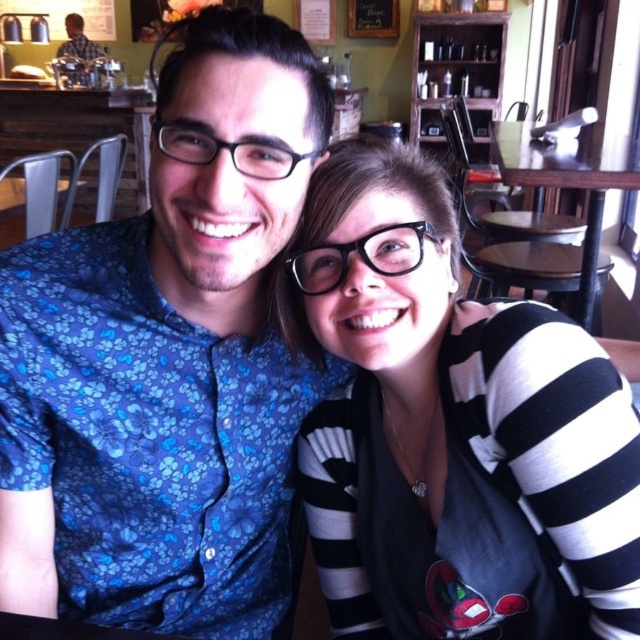
Please provide the 2D coordinates of the black and white striped sweater at center in the image. The coordinates should be in the format of a point with two decimal places, like this example format pointX, pointY. Your answer should only contain the coordinates without any additional text or explanation.

The 2D coordinates of the black and white striped sweater at center are at point (451, 428).

You are a photographer trying to capture a candid shot of the two people in the scene. You notice the black and white striped sweater at center and the brushed metal water at bottle left. Which object should you focus on first if you want to ensure both subjects are in focus?

The black and white striped sweater at center is taller than the brushed metal water at bottle left, so focusing on the taller object first would help ensure both are in focus.

You are sitting at a table in a cafe and want to place your coffee mug on the wooden table at right. However, there is a black and white striped sweater at center in the way. Can you easily slide the mug past the sweater to the table?

The black and white striped sweater at center is closer to the viewer than the wooden table at right, so the sweater is in front of the table. This means you can slide the mug past the sweater towards the table since the sweater is not blocking the path to the table but is positioned in front of it.